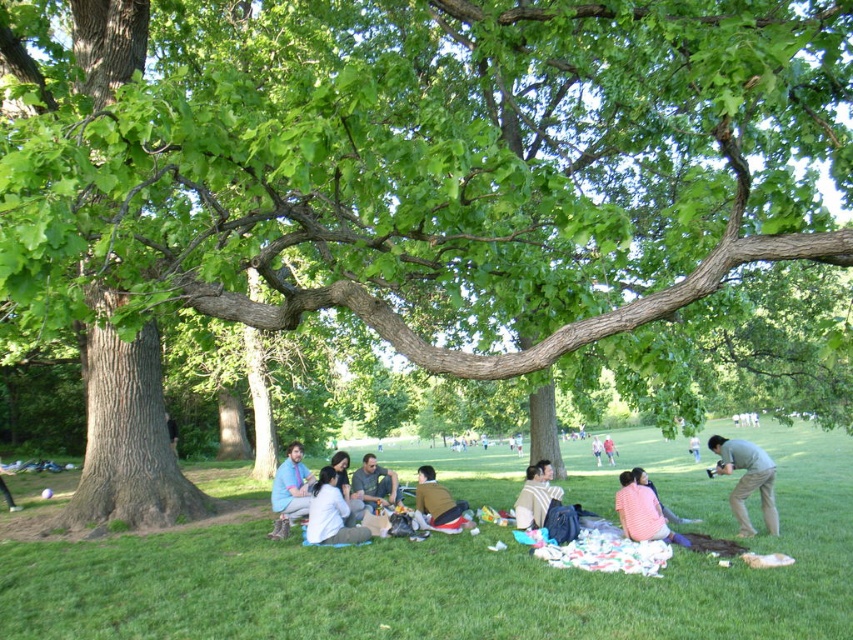
Is point (680, 538) more distant than point (610, 456)?

No.

Does pink cotton sweater at lower center appear on the left side of light blue shirt at center?

Correct, you'll find pink cotton sweater at lower center to the left of light blue shirt at center.

What do you see at coordinates (640, 512) in the screenshot?
I see `pink cotton sweater at lower center` at bounding box center [640, 512].

Where is `pink cotton sweater at lower center`? pink cotton sweater at lower center is located at coordinates (640, 512).

Between brown leather jacket at center and light blue jeans at lower right, which one has more height?

light blue jeans at lower right

Between point (434, 499) and point (688, 445), which one is positioned in front?

Point (434, 499)

Identify the location of brown leather jacket at center. Image resolution: width=853 pixels, height=640 pixels. [x=438, y=500].

Is light blue fabric shirt at lower left below gray fabric shirt at center?

Correct, light blue fabric shirt at lower left is located below gray fabric shirt at center.

Looking at this image, which is more to the left, light blue fabric shirt at lower left or gray fabric shirt at center?

Positioned to the left is light blue fabric shirt at lower left.

Where is `light blue fabric shirt at lower left`? light blue fabric shirt at lower left is located at coordinates (289, 490).

Image resolution: width=853 pixels, height=640 pixels. What are the coordinates of `light blue fabric shirt at lower left` in the screenshot? It's located at (x=289, y=490).